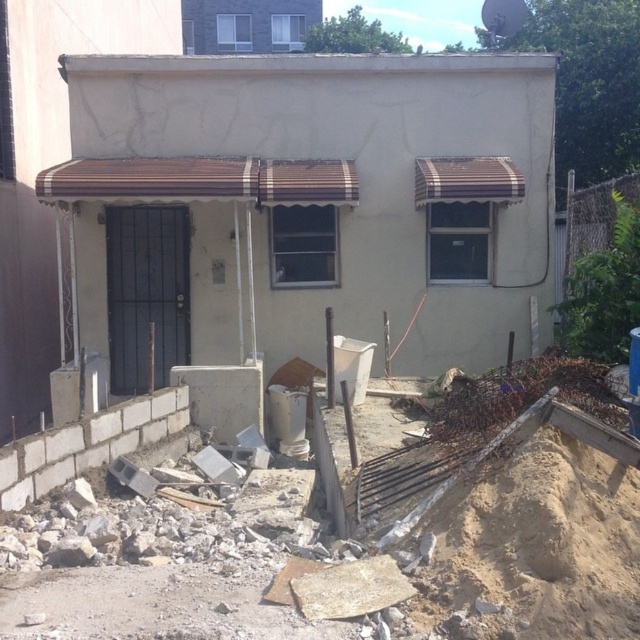
Question: Does beige stucco house at center lie in front of white block wall at lower left?

Choices:
 (A) yes
 (B) no

Answer: (B)

Question: Is beige stucco house at center in front of white block wall at lower left?

Choices:
 (A) yes
 (B) no

Answer: (B)

Question: Among these points, which one is nearest to the camera?

Choices:
 (A) (160, 403)
 (B) (240, 56)

Answer: (A)

Question: Does beige stucco house at center appear under white block wall at lower left?

Choices:
 (A) yes
 (B) no

Answer: (B)

Question: Which point is closer to the camera?

Choices:
 (A) click(x=154, y=259)
 (B) click(x=49, y=458)

Answer: (B)